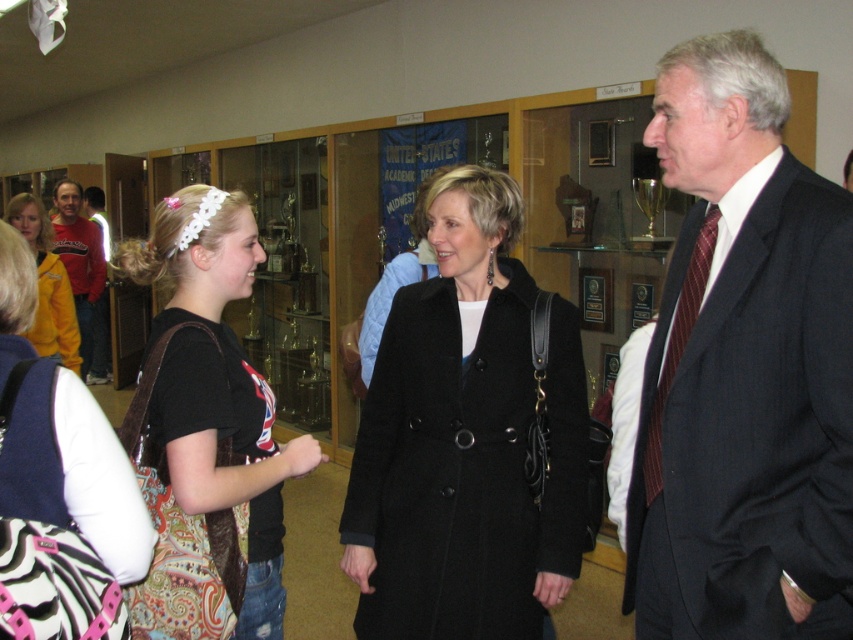
Measure the distance from zebra-patterned backpack at lower left to maroon striped tie at right.

They are 35.60 inches apart.

Is point (91, 481) closer to camera compared to point (659, 438)?

Yes.

Where is `zebra-patterned backpack at lower left`? zebra-patterned backpack at lower left is located at coordinates (59, 486).

Does matte red hoodie at left have a lesser width compared to maroon striped tie at right?

No.

Can you confirm if matte red hoodie at left is positioned below maroon striped tie at right?

Incorrect, matte red hoodie at left is not positioned below maroon striped tie at right.

Does point (68, 264) come farther from viewer compared to point (648, 467)?

Yes, it is.

Locate an element on the screen. matte red hoodie at left is located at coordinates (79, 259).

Which is behind, point (57, 328) or point (700, 275)?

The point (57, 328) is more distant.

Can you confirm if matte yellow jacket at left is thinner than maroon striped tie at right?

In fact, matte yellow jacket at left might be wider than maroon striped tie at right.

Where is `matte yellow jacket at left`? matte yellow jacket at left is located at coordinates (47, 285).

Where is `matte yellow jacket at left`? matte yellow jacket at left is located at coordinates pos(47,285).